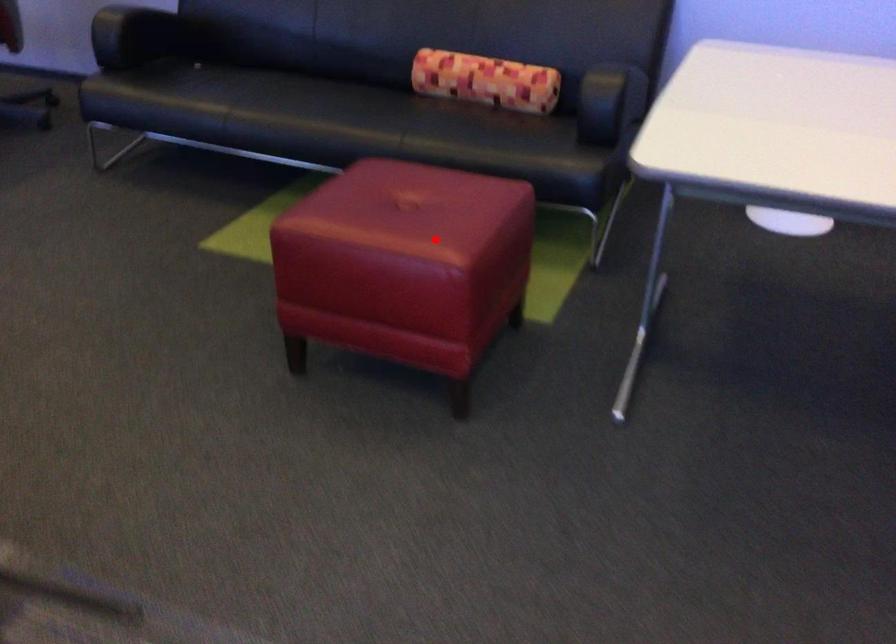
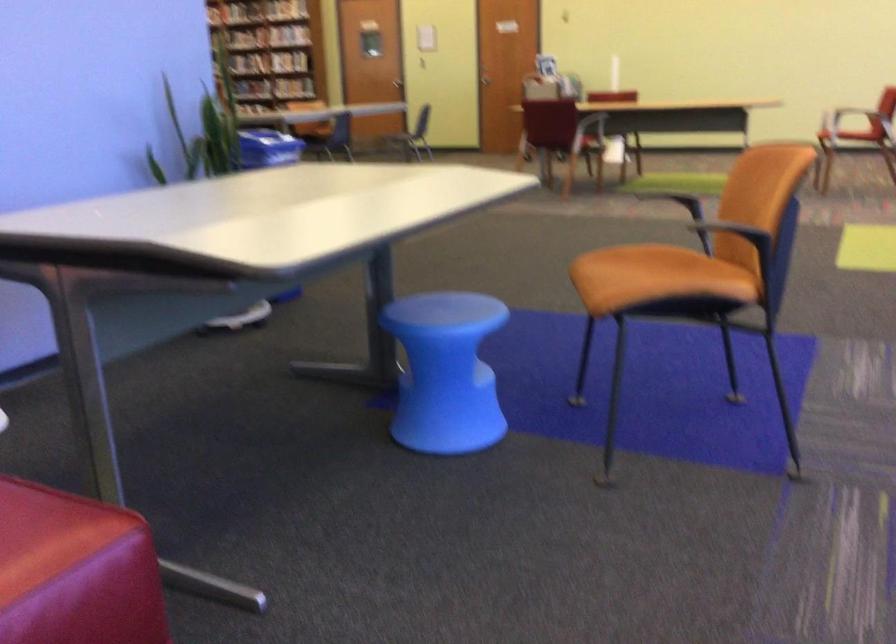
Locate, in the second image, the point that corresponds to the highlighted location in the first image.

(47, 534)